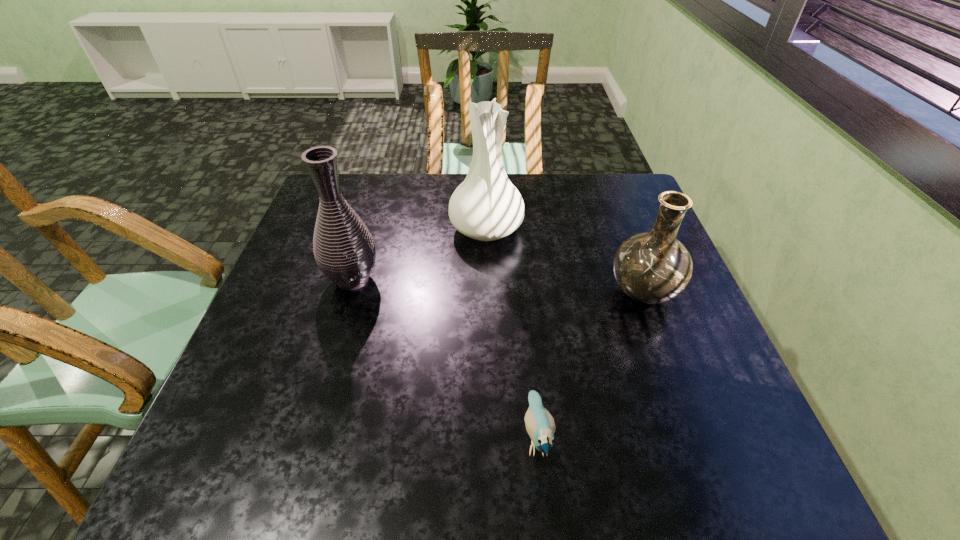
What are the coordinates of `object that is at the far edge` in the screenshot? It's located at (486, 206).

Identify the location of object located in the near edge section of the desktop. (540, 425).

The height and width of the screenshot is (540, 960). Identify the location of object present at the left edge. (345, 252).

Locate an element on the screen. The height and width of the screenshot is (540, 960). object that is positioned at the right edge is located at coordinates (653, 267).

This screenshot has width=960, height=540. I want to click on free region at the far edge of the desktop, so click(x=366, y=211).

Find the location of a particular element. The width and height of the screenshot is (960, 540). free space at the left edge is located at coordinates (290, 285).

In the image, there is a desktop. Where is `vacant region at the right edge`? vacant region at the right edge is located at coordinates (626, 219).

You are a GUI agent. You are given a task and a screenshot of the screen. Output one action in this format:
    pyautogui.click(x=<x>, y=<y>)
    Task: Click on the free space between the leftmost vase and the farthest vase
    Image resolution: width=960 pixels, height=540 pixels.
    Given the screenshot: What is the action you would take?
    pyautogui.click(x=420, y=254)

In order to click on blank region between the shortest object and the farthest object in this screenshot , I will do `click(512, 333)`.

You are a GUI agent. You are given a task and a screenshot of the screen. Output one action in this format:
    pyautogui.click(x=<x>, y=<y>)
    Task: Click on the empty space between the leftmost vase and the second vase from left to right
    
    Given the screenshot: What is the action you would take?
    pyautogui.click(x=420, y=254)